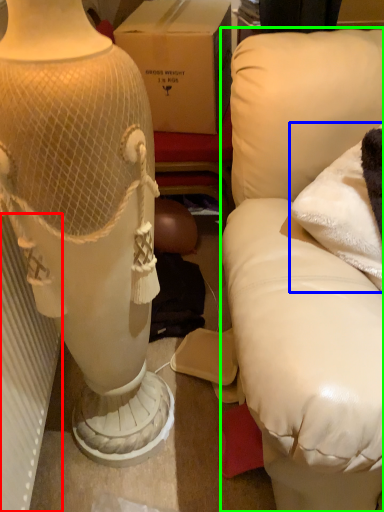
Question: Based on their relative distances, which object is farther from radiator (highlighted by a red box)? Choose from pillow (highlighted by a blue box) and furniture (highlighted by a green box).

Choices:
 (A) pillow
 (B) furniture

Answer: (A)